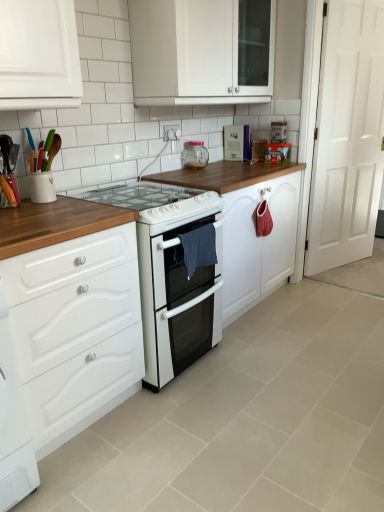
Question: Is white glossy gas stove at center not inside white glossy cabinet at upper center, which is the 1th cabinetry in top-to-bottom order?

Choices:
 (A) yes
 (B) no

Answer: (A)

Question: Can you confirm if white glossy gas stove at center is positioned to the left of white glossy cabinet at upper center, which is the second cabinetry in bottom-to-top order?

Choices:
 (A) yes
 (B) no

Answer: (A)

Question: From a real-world perspective, is white glossy gas stove at center positioned over white glossy cabinet at upper center, which is the second cabinetry in bottom-to-top order, based on gravity?

Choices:
 (A) no
 (B) yes

Answer: (A)

Question: Is white glossy gas stove at center shorter than white glossy cabinet at upper center, which is the 1th cabinetry in top-to-bottom order?

Choices:
 (A) no
 (B) yes

Answer: (B)

Question: From the image's perspective, is white glossy gas stove at center below white glossy cabinet at upper center, which is the 1th cabinetry in top-to-bottom order?

Choices:
 (A) no
 (B) yes

Answer: (B)

Question: From the image's perspective, is white glossy cabinet at lower left, the 2th cabinetry from the top, located above or below white wooden door at right?

Choices:
 (A) above
 (B) below

Answer: (B)

Question: Is point (163, 289) closer or farther from the camera than point (350, 84)?

Choices:
 (A) farther
 (B) closer

Answer: (B)

Question: Would you say white glossy cabinet at lower left, the 2th cabinetry from the top, is to the left or to the right of white wooden door at right in the picture?

Choices:
 (A) left
 (B) right

Answer: (A)

Question: From a real-world perspective, is white glossy cabinet at lower left, the first cabinetry when ordered from bottom to top, above or below white wooden door at right?

Choices:
 (A) above
 (B) below

Answer: (B)

Question: Is clear glass jar at upper center, acting as the 2th appliance starting from the left, bigger or smaller than metallic silver book at upper center, positioned as the 3th appliance in left-to-right order?

Choices:
 (A) small
 (B) big

Answer: (A)

Question: From a real-world perspective, is clear glass jar at upper center, positioned as the second appliance in front-to-back order, positioned above or below metallic silver book at upper center, which appears as the 1th appliance when viewed from the back?

Choices:
 (A) above
 (B) below

Answer: (B)

Question: Is point (201, 140) closer or farther from the camera than point (243, 125)?

Choices:
 (A) farther
 (B) closer

Answer: (B)

Question: Considering the positions of clear glass jar at upper center, the second appliance positioned from the top, and metallic silver book at upper center, positioned as the 3th appliance in left-to-right order, in the image, is clear glass jar at upper center, the second appliance positioned from the top, taller or shorter than metallic silver book at upper center, positioned as the 3th appliance in left-to-right order,?

Choices:
 (A) tall
 (B) short

Answer: (B)

Question: Is white wooden door at right wider or thinner than white glossy gas stove at center?

Choices:
 (A) wide
 (B) thin

Answer: (B)

Question: Which is correct: white wooden door at right is inside white glossy gas stove at center, or outside of it?

Choices:
 (A) outside
 (B) inside

Answer: (A)